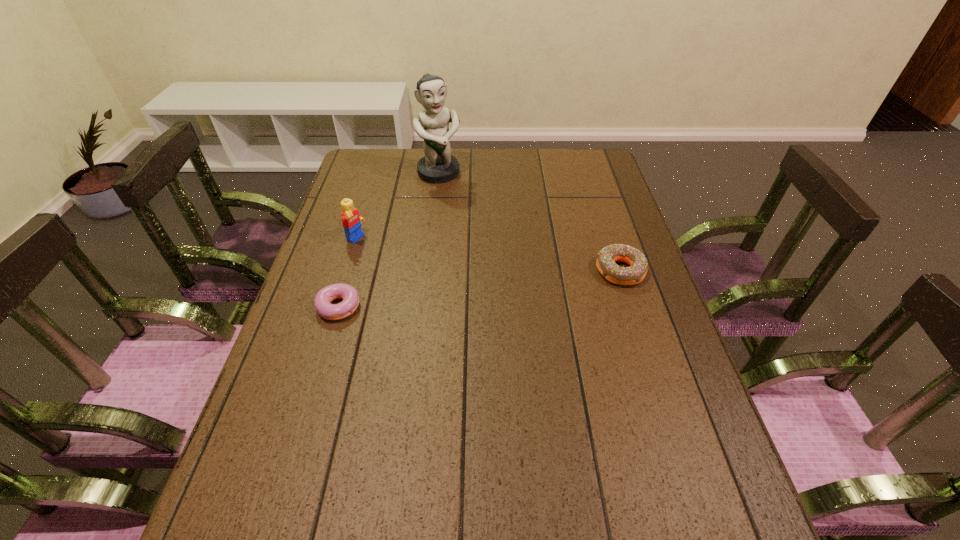
Locate an element on the screen. the left doughnut is located at coordinates (323, 299).

Where is `the shortest object`? the shortest object is located at coordinates (323, 299).

Where is `the taller doughnut`? This screenshot has width=960, height=540. the taller doughnut is located at coordinates (606, 258).

Where is `the rightmost object`? The width and height of the screenshot is (960, 540). the rightmost object is located at coordinates (606, 258).

What are the coordinates of `Lego` in the screenshot? It's located at 351,220.

Where is `the third shortest object`? the third shortest object is located at coordinates (351, 220).

Identify the location of the tallest object. The height and width of the screenshot is (540, 960). (438, 166).

This screenshot has width=960, height=540. I want to click on figurine, so click(x=438, y=166).

You are a GUI agent. You are given a task and a screenshot of the screen. Output one action in this format:
    pyautogui.click(x=<x>, y=<y>)
    Task: Click on the free space located 0.200m on the right of the left doughnut
    
    Given the screenshot: What is the action you would take?
    pyautogui.click(x=439, y=305)

The image size is (960, 540). I want to click on free region located 0.150m on the left of the third tallest object, so click(541, 271).